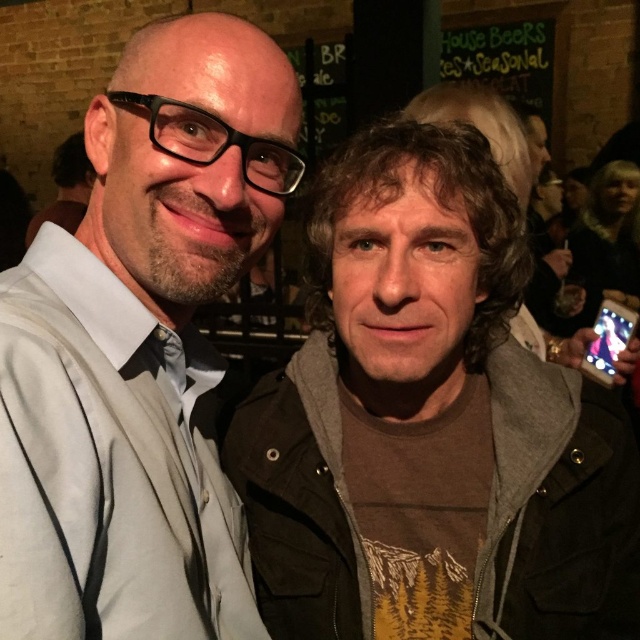
Question: Is brown cotton shirt at center to the right of matte black jacket at left from the viewer's perspective?

Choices:
 (A) no
 (B) yes

Answer: (B)

Question: Does brown cotton shirt at center appear under matte black jacket at left?

Choices:
 (A) no
 (B) yes

Answer: (B)

Question: Which object appears closest to the camera in this image?

Choices:
 (A) brown cotton shirt at center
 (B) matte black jacket at left

Answer: (B)

Question: Among these points, which one is nearest to the camera?

Choices:
 (A) (294, 516)
 (B) (170, 220)

Answer: (B)

Question: Does brown cotton shirt at center appear over matte black jacket at left?

Choices:
 (A) no
 (B) yes

Answer: (A)